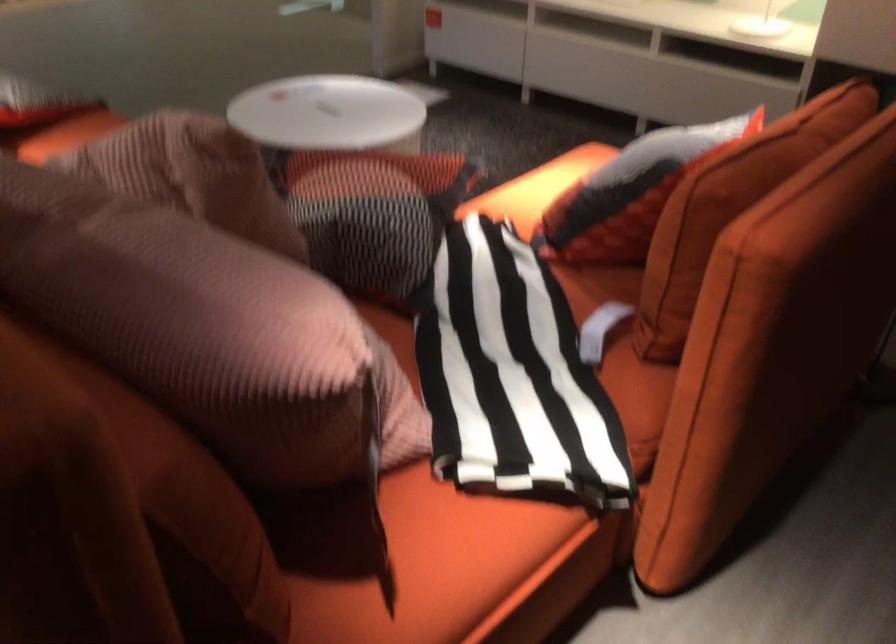
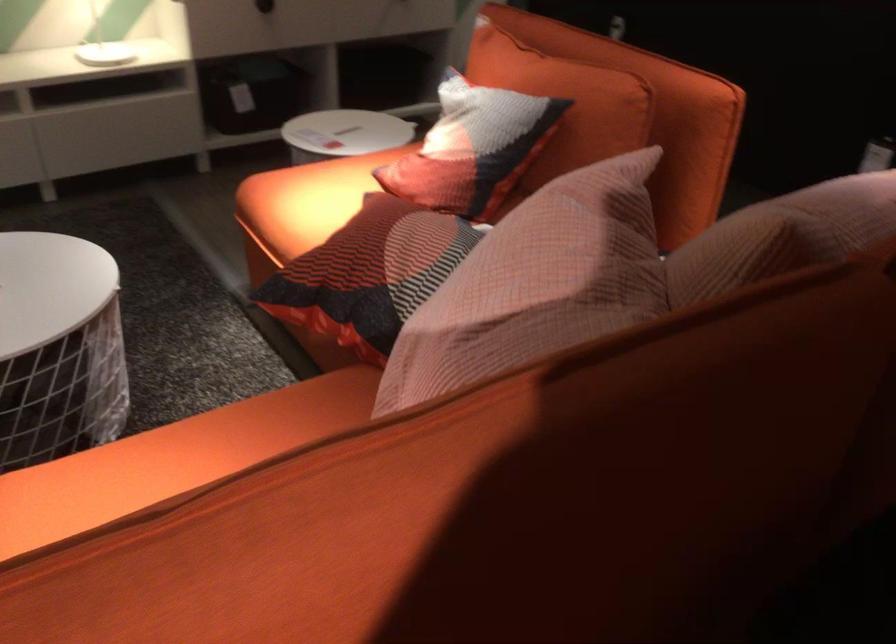
The point at [552,163] is marked in the first image. Where is the corresponding point in the second image?

(306, 200)